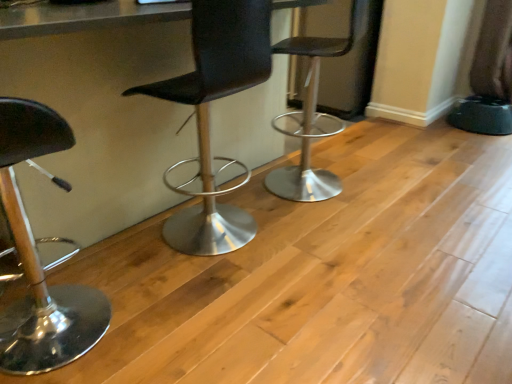
Question: Which direction should I rotate to look at black leather stool at center, the third chair viewed from the left?

Choices:
 (A) right
 (B) left

Answer: (A)

Question: From the image's perspective, would you say black leather stool at center, the third chair viewed from the left, is shown under shiny black stool at left, the 1th chair positioned from the left?

Choices:
 (A) no
 (B) yes

Answer: (A)

Question: From a real-world perspective, is black leather stool at center, the third chair viewed from the left, located beneath shiny black stool at left, the third chair positioned from the right?

Choices:
 (A) yes
 (B) no

Answer: (B)

Question: Is black leather stool at center, which is counted as the 1th chair, starting from the right, next to shiny black stool at left, the third chair positioned from the right?

Choices:
 (A) no
 (B) yes

Answer: (A)

Question: Is black leather stool at center, the third chair viewed from the left, not close to shiny black stool at left, the third chair positioned from the right?

Choices:
 (A) no
 (B) yes

Answer: (B)

Question: Considering the relative sizes of black leather stool at center, which is counted as the 1th chair, starting from the right, and shiny black stool at left, the third chair positioned from the right, in the image provided, is black leather stool at center, which is counted as the 1th chair, starting from the right, thinner than shiny black stool at left, the third chair positioned from the right,?

Choices:
 (A) yes
 (B) no

Answer: (B)

Question: Does black leather stool at center, which is counted as the 1th chair, starting from the right, have a larger size compared to shiny black stool at left, the third chair positioned from the right?

Choices:
 (A) no
 (B) yes

Answer: (B)

Question: From a real-world perspective, is shiny black stool at left, the 1th chair positioned from the left, positioned over black leather stool at center, the third chair viewed from the left, based on gravity?

Choices:
 (A) no
 (B) yes

Answer: (A)

Question: Could black leather stool at center, the third chair viewed from the left, be considered to be inside shiny black stool at left, the 1th chair positioned from the left?

Choices:
 (A) no
 (B) yes

Answer: (A)

Question: From a real-world perspective, is shiny black stool at left, the third chair positioned from the right, under black leather stool at center, which is counted as the 1th chair, starting from the right?

Choices:
 (A) no
 (B) yes

Answer: (B)

Question: From the image's perspective, is shiny black stool at left, the third chair positioned from the right, above black leather stool at center, which is counted as the 1th chair, starting from the right?

Choices:
 (A) yes
 (B) no

Answer: (B)

Question: Is black leather stool at center, which is counted as the 1th chair, starting from the right, at the back of shiny black stool at left, the third chair positioned from the right?

Choices:
 (A) no
 (B) yes

Answer: (A)

Question: Is shiny black stool at left, the third chair positioned from the right, outside black leather stool at center, which is counted as the 1th chair, starting from the right?

Choices:
 (A) no
 (B) yes

Answer: (B)

Question: Are black leather stool at center, which is counted as the 1th chair, starting from the right, and black leather chair at center, which is the 2th chair in left-to-right order, beside each other?

Choices:
 (A) no
 (B) yes

Answer: (A)